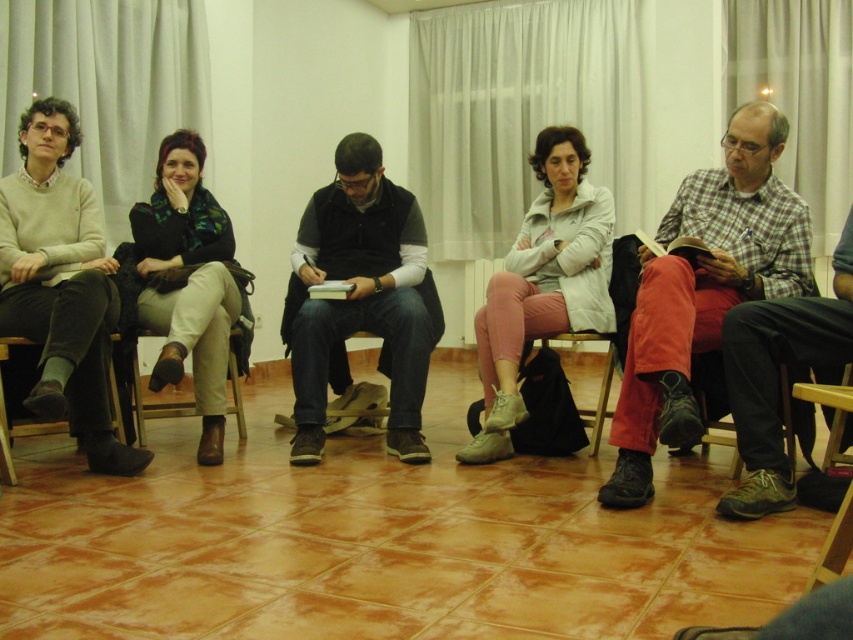
Question: Is plaid fabric shirt at center positioned at the back of light pink fabric pants at center?

Choices:
 (A) no
 (B) yes

Answer: (A)

Question: Is dark gray sweater at center behind light pink fabric pants at center?

Choices:
 (A) yes
 (B) no

Answer: (A)

Question: Which object is the farthest from the green knitted scarf at center?

Choices:
 (A) dark gray sweater at center
 (B) plaid flannel shirt at right
 (C) light pink fabric pants at center

Answer: (B)

Question: Estimate the real-world distances between objects in this image. Which object is farther from the plaid flannel shirt at right?

Choices:
 (A) plaid fabric shirt at center
 (B) matte gray sweater at left
 (C) light pink fabric pants at center

Answer: (B)

Question: Estimate the real-world distances between objects in this image. Which object is closer to the plaid fabric shirt at center?

Choices:
 (A) matte gray sweater at left
 (B) plaid flannel shirt at right

Answer: (B)

Question: Does dark gray sweater at center have a smaller size compared to wooden chair at lower right?

Choices:
 (A) yes
 (B) no

Answer: (B)